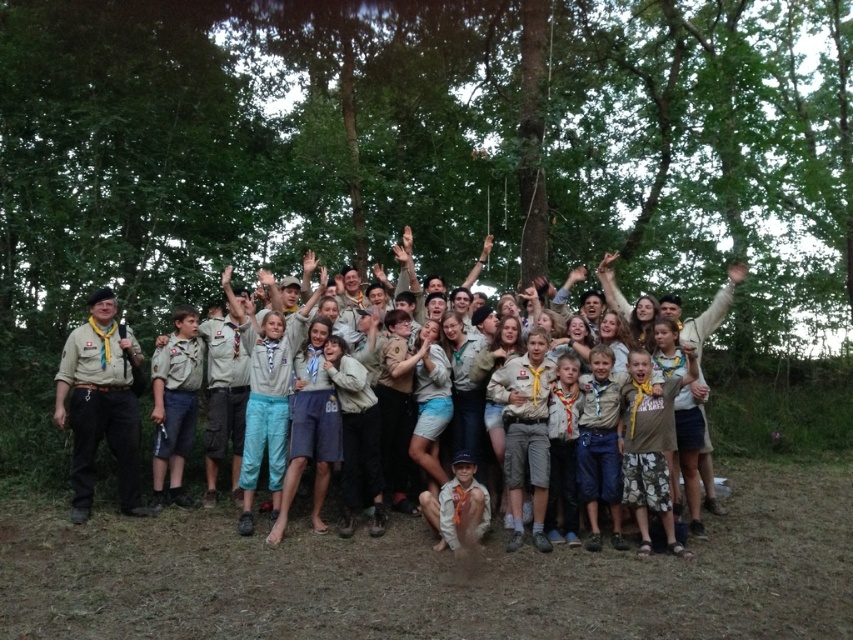
Question: Which of the following is the farthest from the observer?

Choices:
 (A) (283, 61)
 (B) (100, 433)
 (C) (672, 307)

Answer: (A)

Question: Can you confirm if brown uniform at center is positioned below matte khaki beret at left?

Choices:
 (A) no
 (B) yes

Answer: (B)

Question: Which object is positioned farthest from the green leafy tree at center?

Choices:
 (A) matte khaki beret at left
 (B) brown uniform at center

Answer: (B)

Question: Does green leafy tree at center have a lesser width compared to matte khaki beret at left?

Choices:
 (A) yes
 (B) no

Answer: (B)

Question: Among these points, which one is farthest from the camera?

Choices:
 (A) (483, 128)
 (B) (711, 308)
 (C) (73, 340)

Answer: (A)

Question: Can you confirm if green leafy tree at center is positioned below brown uniform at center?

Choices:
 (A) yes
 (B) no

Answer: (B)